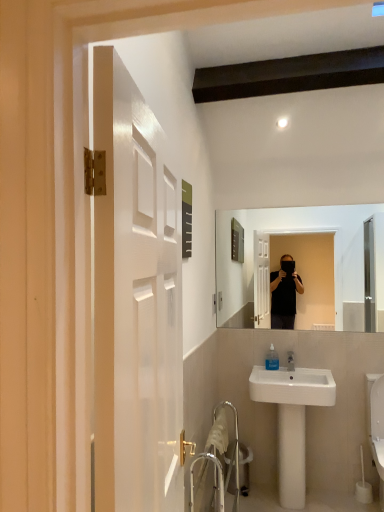
Question: Should I look upward or downward to see metallic silver trash can at lower center?

Choices:
 (A) up
 (B) down

Answer: (B)

Question: Is white glossy toilet at lower right completely or partially inside white ceramic sink at lower right?

Choices:
 (A) no
 (B) yes

Answer: (A)

Question: Is white ceramic sink at lower right shorter than white glossy toilet at lower right?

Choices:
 (A) yes
 (B) no

Answer: (B)

Question: Considering the relative sizes of white ceramic sink at lower right and white glossy toilet at lower right in the image provided, is white ceramic sink at lower right wider than white glossy toilet at lower right?

Choices:
 (A) yes
 (B) no

Answer: (B)

Question: From the image's perspective, is white ceramic sink at lower right on white glossy toilet at lower right?

Choices:
 (A) no
 (B) yes

Answer: (B)

Question: Are white ceramic sink at lower right and white glossy toilet at lower right located far from each other?

Choices:
 (A) no
 (B) yes

Answer: (A)

Question: Can you confirm if white ceramic sink at lower right is bigger than white glossy toilet at lower right?

Choices:
 (A) no
 (B) yes

Answer: (B)

Question: Is white ceramic sink at lower right beside metallic silver trash can at lower center?

Choices:
 (A) yes
 (B) no

Answer: (B)

Question: Is white ceramic sink at lower right to the left of metallic silver trash can at lower center from the viewer's perspective?

Choices:
 (A) yes
 (B) no

Answer: (B)

Question: From the image's perspective, would you say white ceramic sink at lower right is shown under metallic silver trash can at lower center?

Choices:
 (A) no
 (B) yes

Answer: (A)

Question: Is white ceramic sink at lower right positioned beyond the bounds of metallic silver trash can at lower center?

Choices:
 (A) yes
 (B) no

Answer: (A)

Question: Could you tell me if white ceramic sink at lower right is turned towards metallic silver trash can at lower center?

Choices:
 (A) no
 (B) yes

Answer: (A)

Question: From the image's perspective, would you say white ceramic sink at lower right is positioned over metallic silver trash can at lower center?

Choices:
 (A) yes
 (B) no

Answer: (A)

Question: From a real-world perspective, is white glossy toilet at lower right on white ceramic sink at lower right?

Choices:
 (A) no
 (B) yes

Answer: (A)